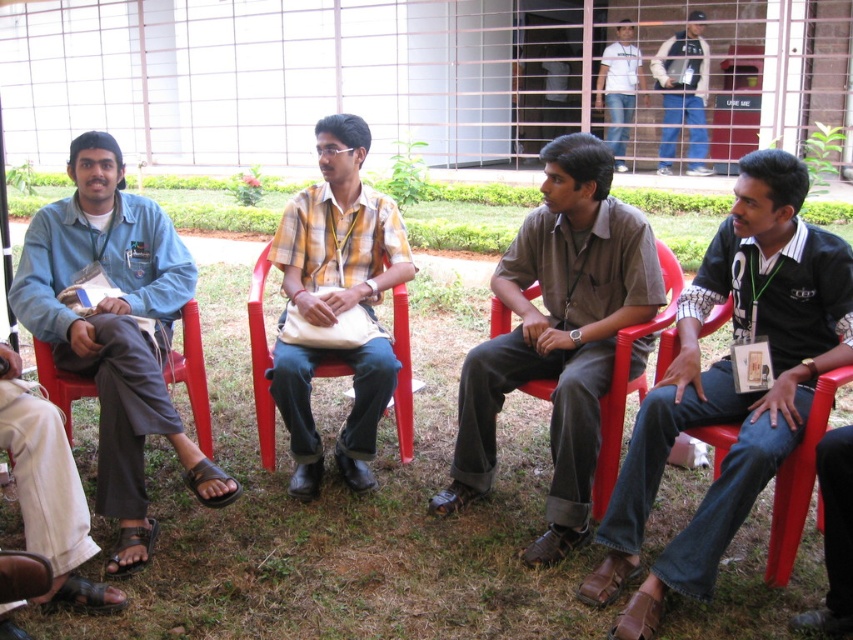
Is brown cotton shirt at center above red plastic chair at right?

Indeed, brown cotton shirt at center is positioned over red plastic chair at right.

This screenshot has width=853, height=640. Describe the element at coordinates (558, 333) in the screenshot. I see `brown cotton shirt at center` at that location.

What do you see at coordinates (558, 333) in the screenshot? This screenshot has height=640, width=853. I see `brown cotton shirt at center` at bounding box center [558, 333].

Find the location of a particular element. The height and width of the screenshot is (640, 853). brown cotton shirt at center is located at coordinates (558, 333).

Can you confirm if red plastic chair at center is positioned to the left of denim jacket at upper right?

Yes, red plastic chair at center is to the left of denim jacket at upper right.

Between red plastic chair at center and denim jacket at upper right, which one has less height?

Standing shorter between the two is red plastic chair at center.

You are a GUI agent. You are given a task and a screenshot of the screen. Output one action in this format:
    pyautogui.click(x=<x>, y=<y>)
    Task: Click on the red plastic chair at center
    The height and width of the screenshot is (640, 853).
    Given the screenshot: What is the action you would take?
    pyautogui.click(x=628, y=381)

Does denim shirt at left have a smaller size compared to white t-shirt at upper center?

Indeed, denim shirt at left has a smaller size compared to white t-shirt at upper center.

Which is in front, point (35, 234) or point (625, 76)?

Positioned in front is point (35, 234).

Identify the location of denim shirt at left. This screenshot has width=853, height=640. (115, 330).